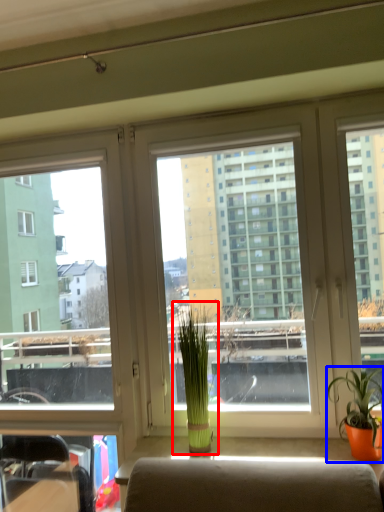
Question: Which point is closer to the camera, houseplant (highlighted by a red box) or houseplant (highlighted by a blue box)?

Choices:
 (A) houseplant
 (B) houseplant

Answer: (B)